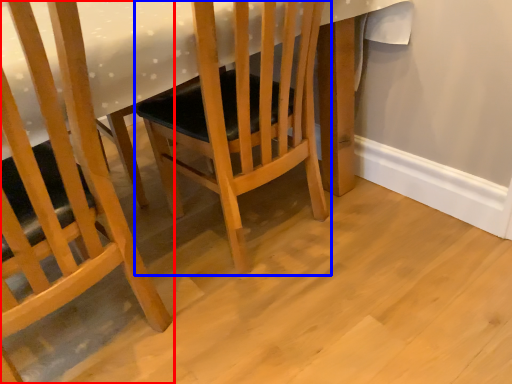
Question: Which of the following is the closest to the observer, chair (highlighted by a red box) or chair (highlighted by a blue box)?

Choices:
 (A) chair
 (B) chair

Answer: (A)